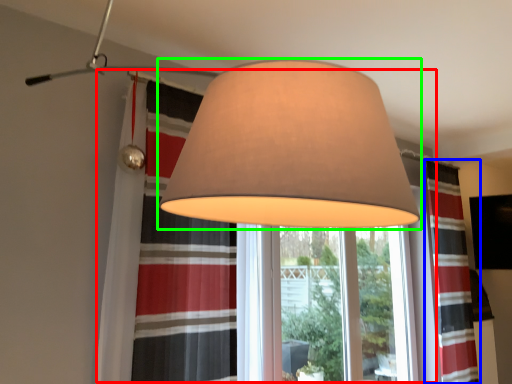
Question: Estimate the real-world distances between objects in this image. Which object is farther from bay window (highlighted by a red box), curtain (highlighted by a blue box) or lamp (highlighted by a green box)?

Choices:
 (A) curtain
 (B) lamp

Answer: (A)